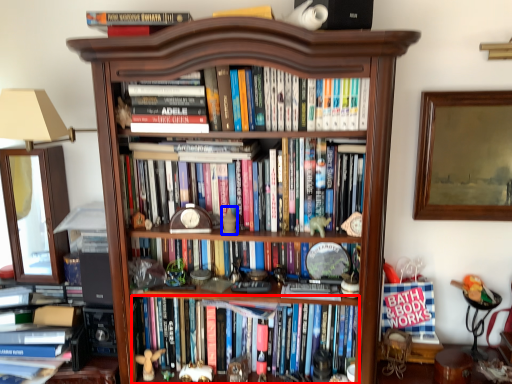
Question: Which point is further to the camera, book (highlighted by a red box) or toy (highlighted by a blue box)?

Choices:
 (A) book
 (B) toy

Answer: (A)